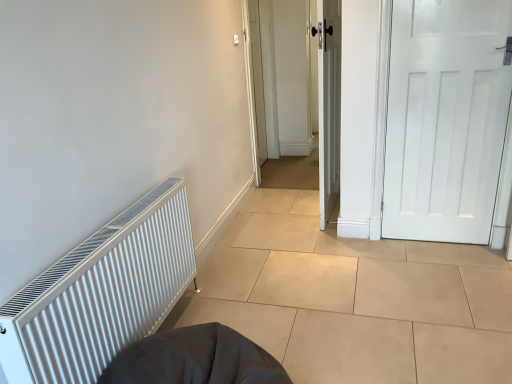
Identify the location of vacant region to the left of white wooden door at center, marked as the second door in a right-to-left arrangement. (x=276, y=213).